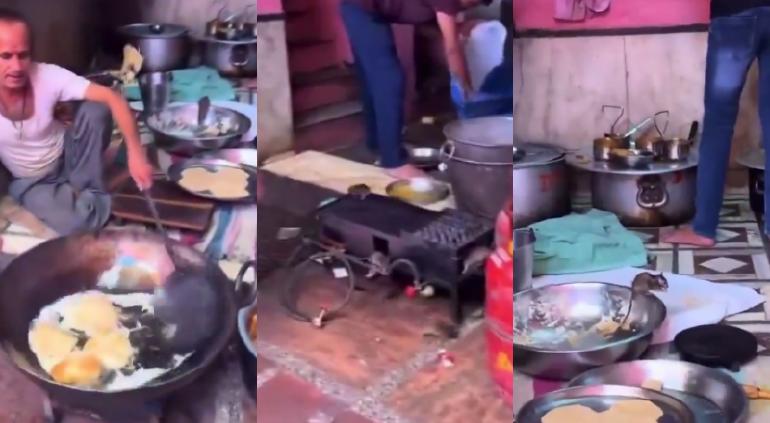
Where is `dish`? This screenshot has width=770, height=423. dish is located at coordinates (720, 395), (586, 392).